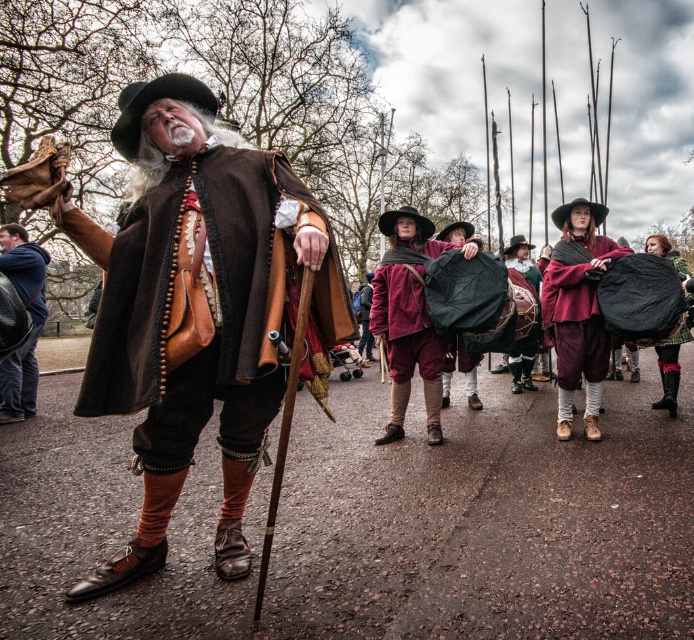
You are a photographer at the historical reenactment event. You want to take a photo of the maroon fabric cape at center. Where should you position your camera to capture it best?

The maroon fabric cape at center is located at the 2D coordinates point (577, 312), so position your camera to aim directly at that point to capture it best.

You are standing at the point labeled as point (577, 312) in the image. What object is located exactly at this point?

The point (577, 312) corresponds to the maroon fabric cape at center.